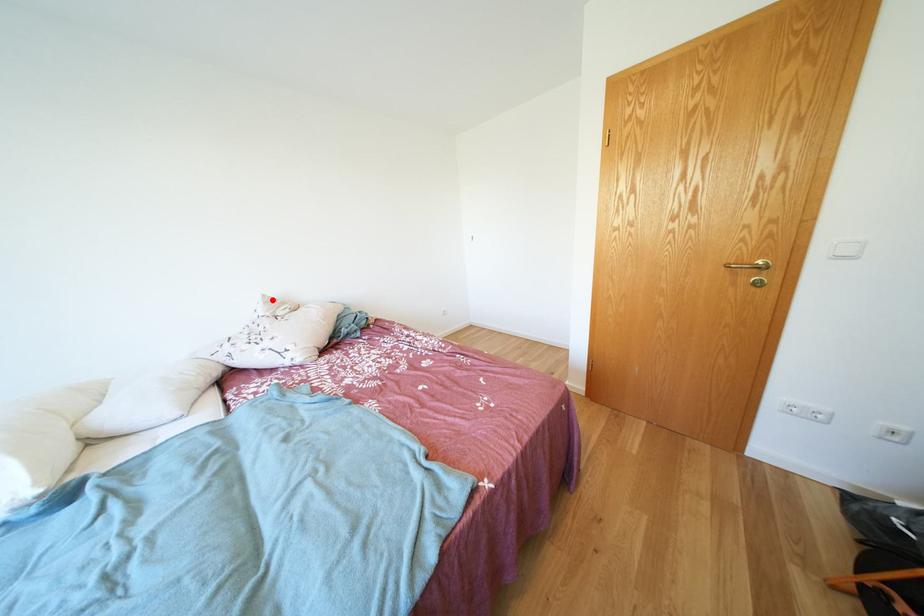
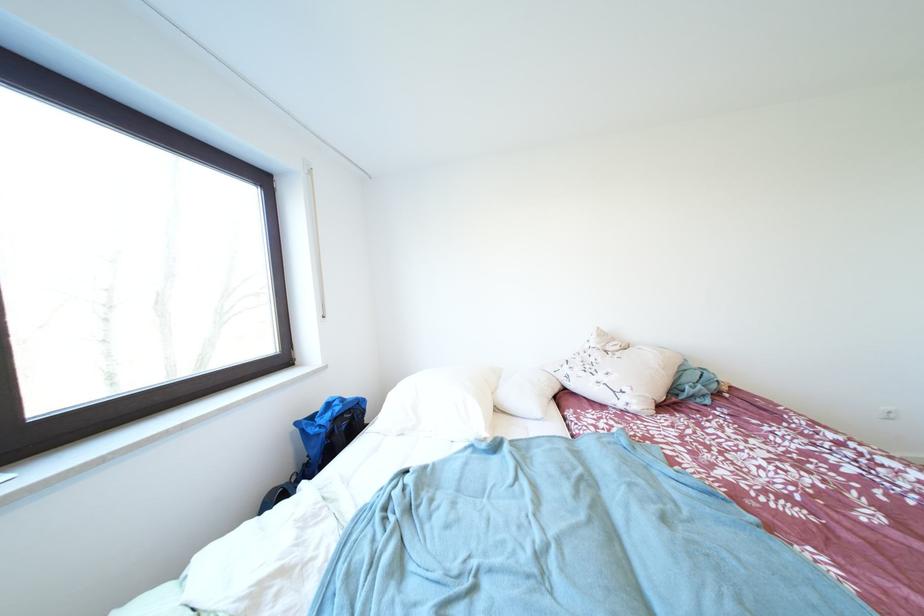
Locate, in the second image, the point that corresponds to the highlighted location in the first image.

(606, 333)